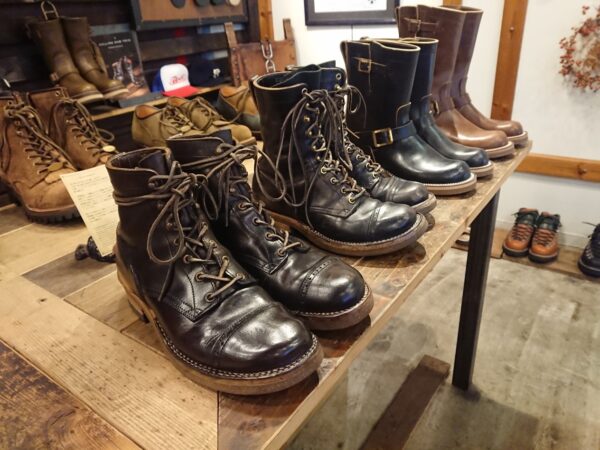
The image size is (600, 450). I want to click on floor, so click(446, 329).